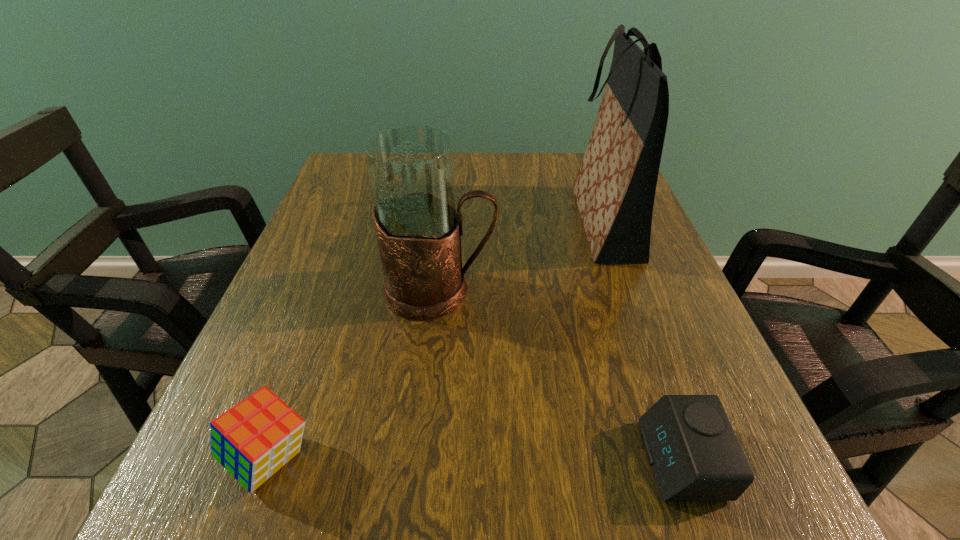
Identify the location of shopping bag. Image resolution: width=960 pixels, height=540 pixels. (614, 189).

Identify the location of the third object from right to left. The image size is (960, 540). (x=411, y=168).

This screenshot has height=540, width=960. In order to click on the third shortest object in this screenshot , I will do coord(411,168).

This screenshot has width=960, height=540. Identify the location of the third tallest object. (254, 439).

Locate an element on the screen. This screenshot has height=540, width=960. cube is located at coordinates (254, 439).

Where is `the shortest object`? The height and width of the screenshot is (540, 960). the shortest object is located at coordinates (694, 454).

I want to click on blank area located 0.320m on the front-facing side of the tallest object, so click(420, 222).

What are the coordinates of `vacant space located 0.370m on the front-facing side of the tallest object` in the screenshot? It's located at (397, 222).

The image size is (960, 540). What are the coordinates of `free space located on the front-facing side of the tallest object` in the screenshot? It's located at (490, 222).

The width and height of the screenshot is (960, 540). Identify the location of free spot located 0.260m with the handle on the side of the second tallest object. (638, 291).